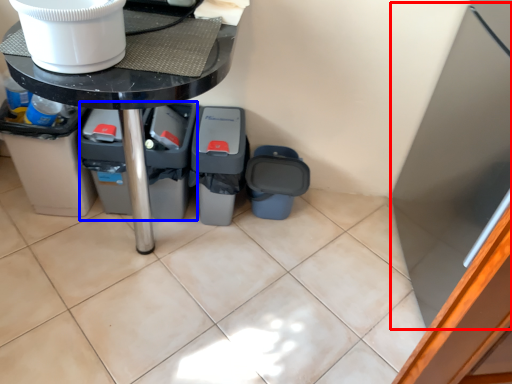
Question: Which object is closer to the camera taking this photo, appliance (highlighted by a red box) or bin (highlighted by a blue box)?

Choices:
 (A) appliance
 (B) bin

Answer: (A)